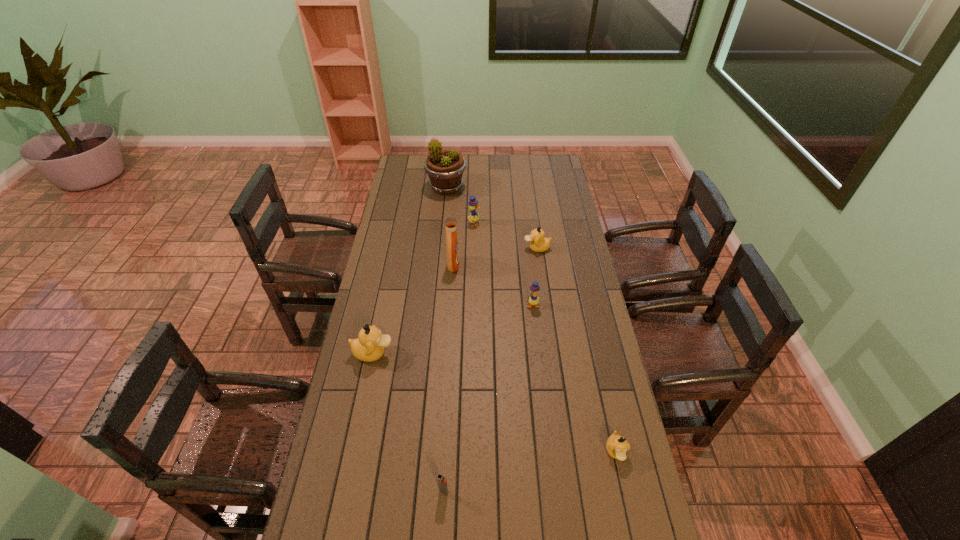
Find the location of `free region at the far left corner of the desktop`. free region at the far left corner of the desktop is located at coordinates (425, 176).

Find the location of `free space between the nearest object and the fifth nearest object`. free space between the nearest object and the fifth nearest object is located at coordinates (448, 379).

I want to click on free space between the igniter and the fourth farthest object, so point(448,379).

The image size is (960, 540). Find the location of `vacant area that lies between the fourth duckling from right to left and the tallest object`. vacant area that lies between the fourth duckling from right to left and the tallest object is located at coordinates (460, 206).

I want to click on empty location between the fourth farthest object and the fourth duckling from right to left, so click(464, 245).

Where is `free space between the nearest object and the farther yellow duckling`? free space between the nearest object and the farther yellow duckling is located at coordinates (459, 357).

Where is `free spot between the detergent and the bigger yellow duckling`? This screenshot has height=540, width=960. free spot between the detergent and the bigger yellow duckling is located at coordinates 464,245.

Locate an element on the screen. empty space between the igniter and the second biggest tan duckling is located at coordinates (491, 370).

Identify which object is located as the fourth nearest to the right yellow duckling. Please provide its 2D coordinates. Your answer should be formatted as a tuple, i.e. [(x, y)], where the tuple contains the x and y coordinates of a point satisfying the conditions above.

[(369, 346)]

Where is `object that is the second nearest to the farthest object`? The image size is (960, 540). object that is the second nearest to the farthest object is located at coordinates (538, 243).